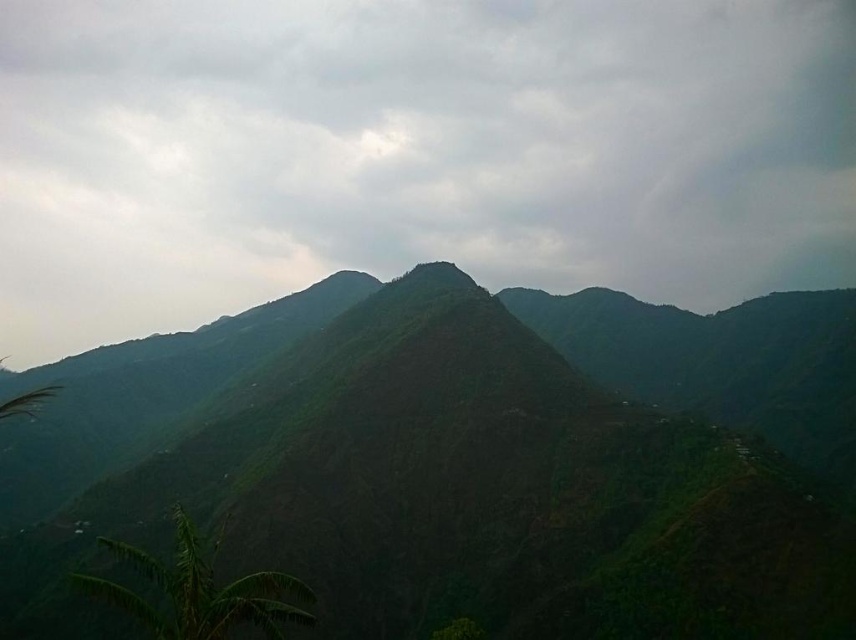
Question: Which object appears farthest from the camera in this image?

Choices:
 (A) green matte cloud at upper center
 (B) green textured mountain at center

Answer: (A)

Question: Which object appears closest to the camera in this image?

Choices:
 (A) green textured mountain at center
 (B) green matte cloud at upper center
 (C) green leafy plant at lower left

Answer: (C)

Question: Can you confirm if green matte cloud at upper center is positioned below green textured mountain at center?

Choices:
 (A) yes
 (B) no

Answer: (B)

Question: Does green matte cloud at upper center have a greater width compared to green leafy plant at lower left?

Choices:
 (A) no
 (B) yes

Answer: (B)

Question: Which of the following is the closest to the observer?

Choices:
 (A) (706, 628)
 (B) (830, 61)
 (C) (223, 621)

Answer: (C)

Question: Where is green textured mountain at center located in relation to green leafy plant at lower left in the image?

Choices:
 (A) left
 (B) right

Answer: (B)